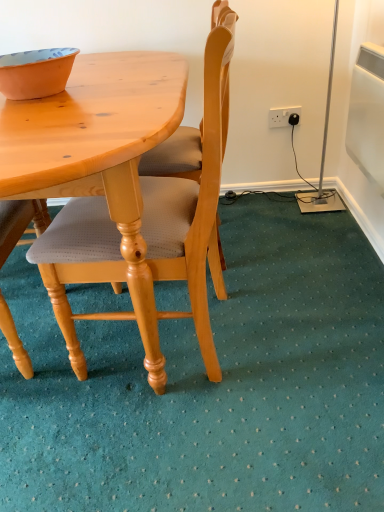
Question: Is light wood/light brown chair at center far from orange matte bowl at upper left?

Choices:
 (A) no
 (B) yes

Answer: (A)

Question: From the image's perspective, is light wood/light brown chair at center on orange matte bowl at upper left?

Choices:
 (A) yes
 (B) no

Answer: (B)

Question: Is the position of light wood/light brown chair at center less distant than that of orange matte bowl at upper left?

Choices:
 (A) no
 (B) yes

Answer: (B)

Question: Does light wood/light brown chair at center appear on the right side of orange matte bowl at upper left?

Choices:
 (A) no
 (B) yes

Answer: (B)

Question: Are light wood/light brown chair at center and orange matte bowl at upper left making contact?

Choices:
 (A) yes
 (B) no

Answer: (B)

Question: Is orange matte bowl at upper left wider or thinner than white plastic power outlet at upper right?

Choices:
 (A) thin
 (B) wide

Answer: (B)

Question: Is orange matte bowl at upper left taller or shorter than white plastic power outlet at upper right?

Choices:
 (A) short
 (B) tall

Answer: (A)

Question: From a real-world perspective, relative to white plastic power outlet at upper right, is orange matte bowl at upper left vertically above or below?

Choices:
 (A) below
 (B) above

Answer: (B)

Question: Considering the positions of point (51, 57) and point (294, 106), is point (51, 57) closer or farther from the camera than point (294, 106)?

Choices:
 (A) closer
 (B) farther

Answer: (A)

Question: Considering the relative positions of light wood/light brown chair at center and orange matte bowl at upper left in the image provided, is light wood/light brown chair at center to the left or to the right of orange matte bowl at upper left?

Choices:
 (A) left
 (B) right

Answer: (B)

Question: Based on their sizes in the image, would you say light wood/light brown chair at center is bigger or smaller than orange matte bowl at upper left?

Choices:
 (A) small
 (B) big

Answer: (B)

Question: From a real-world perspective, is light wood/light brown chair at center positioned above or below orange matte bowl at upper left?

Choices:
 (A) above
 (B) below

Answer: (B)

Question: Relative to orange matte bowl at upper left, is light wood/light brown chair at center in front or behind?

Choices:
 (A) behind
 (B) front

Answer: (B)

Question: From the image's perspective, is white plastic power outlet at upper right located above or below light wood/light brown chair at center?

Choices:
 (A) above
 (B) below

Answer: (A)

Question: Choose the correct answer: Is white plastic power outlet at upper right inside light wood/light brown chair at center or outside it?

Choices:
 (A) inside
 (B) outside

Answer: (B)